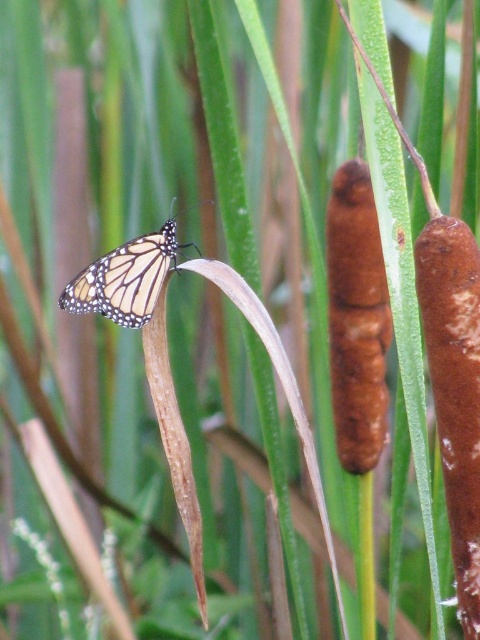
Question: Among these objects, which one is nearest to the camera?

Choices:
 (A) brown fuzzy caterpillar at center-right
 (B) translucent orange butterfly at center

Answer: (B)

Question: Which of the following is the farthest from the observer?

Choices:
 (A) translucent orange butterfly at center
 (B) brown fuzzy caterpillar at center-right

Answer: (B)

Question: Is brown fuzzy caterpillar at center-right positioned at the back of translucent orange butterfly at center?

Choices:
 (A) yes
 (B) no

Answer: (A)

Question: Is brown fuzzy caterpillar at center-right positioned in front of translucent orange butterfly at center?

Choices:
 (A) yes
 (B) no

Answer: (B)

Question: Does brown fuzzy caterpillar at center-right lie in front of translucent orange butterfly at center?

Choices:
 (A) yes
 (B) no

Answer: (B)